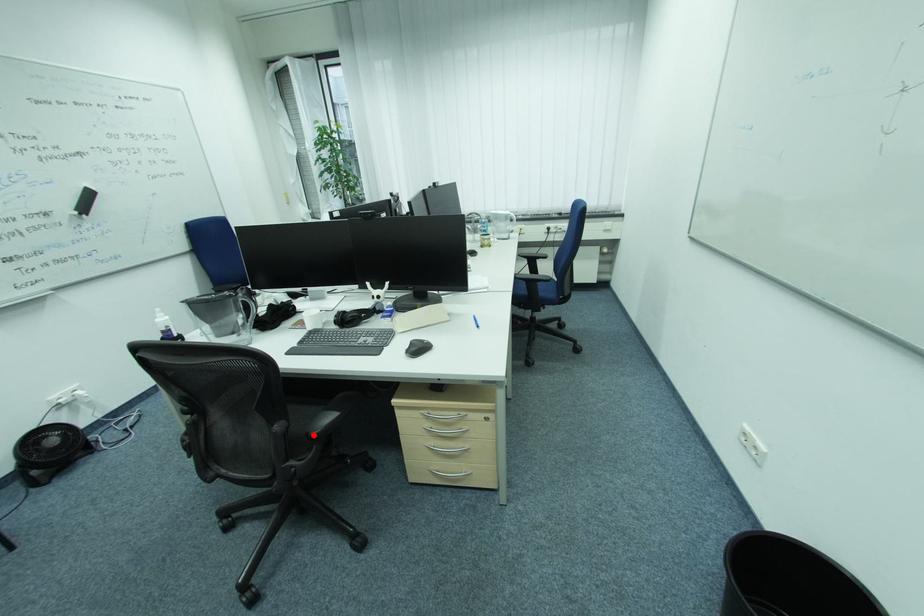
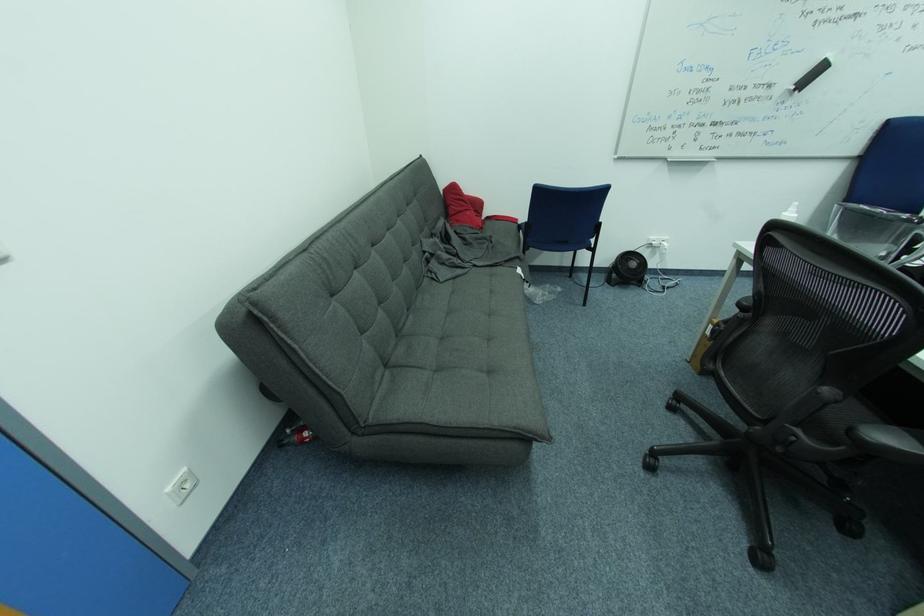
Question: I am providing you with two images of the same scene from different viewpoints. Image1 has a red point marked. In image2, the corresponding 3D location appears at what relative position? Reply with the corresponding letter.

Choices:
 (A) Closer
 (B) Farther

Answer: (A)